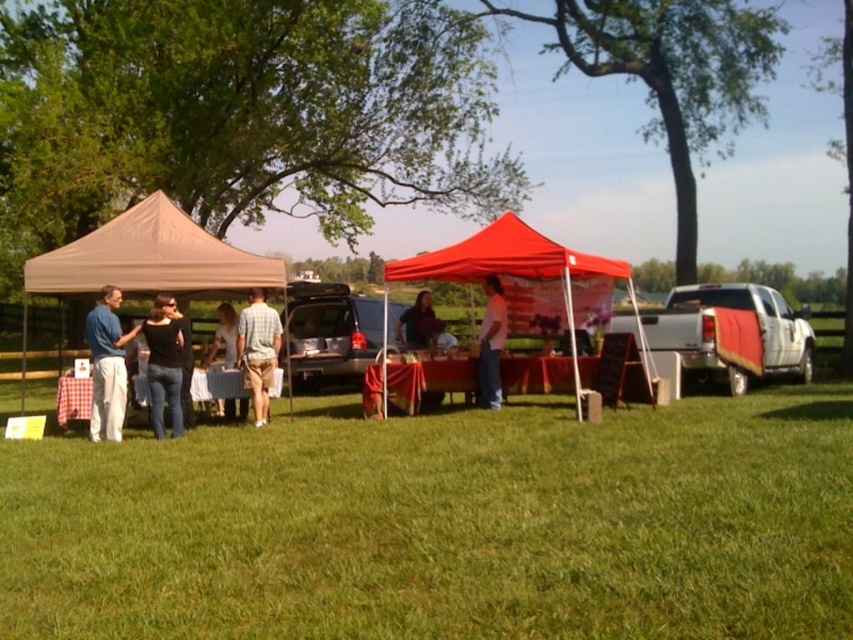
Is white cotton shirt at center in front of light brown plaid shirt at center?

No, it is not.

Can you confirm if white cotton shirt at center is wider than light brown plaid shirt at center?

No.

The image size is (853, 640). What do you see at coordinates (491, 342) in the screenshot? I see `white cotton shirt at center` at bounding box center [491, 342].

The height and width of the screenshot is (640, 853). Identify the location of white cotton shirt at center. (491, 342).

Does beige fabric canopy at left appear on the right side of white matte truck at right?

No, beige fabric canopy at left is not to the right of white matte truck at right.

Is point (201, 252) more distant than point (782, 332)?

No, it is in front of (782, 332).

Locate an element on the screen. This screenshot has width=853, height=640. beige fabric canopy at left is located at coordinates (151, 259).

Can you confirm if green grass at lower center is taller than white matte truck at right?

Incorrect, green grass at lower center's height is not larger of white matte truck at right's.

Is green grass at lower center to the left of white matte truck at right from the viewer's perspective?

Yes, green grass at lower center is to the left of white matte truck at right.

This screenshot has height=640, width=853. I want to click on green grass at lower center, so click(444, 525).